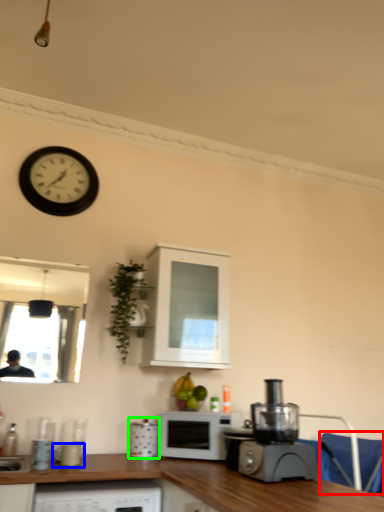
Question: Which is nearer to the armchair (highlighted by a red box)? appliance (highlighted by a blue box) or appliance (highlighted by a green box).

Choices:
 (A) appliance
 (B) appliance

Answer: (B)